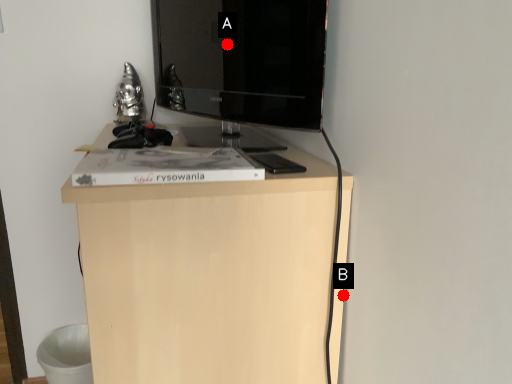
Question: Two points are circled on the image, labeled by A and B beside each circle. Which point appears farthest from the camera in this image?

Choices:
 (A) A is further
 (B) B is further

Answer: (A)